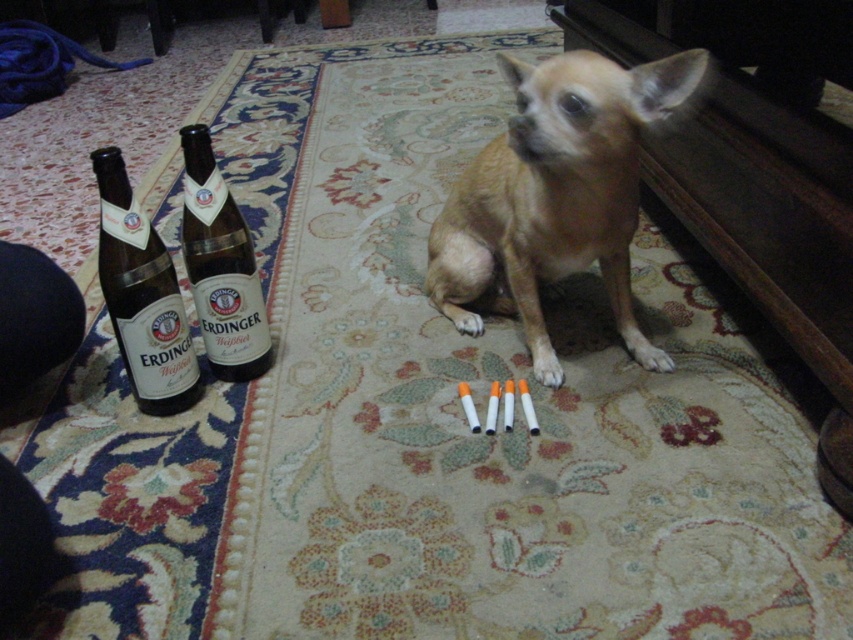
Question: Does brown glass beer bottle at left have a smaller size compared to brown glass bottle at left?

Choices:
 (A) no
 (B) yes

Answer: (B)

Question: Does light brown fur at center appear on the left side of brown glass bottle at left?

Choices:
 (A) yes
 (B) no

Answer: (B)

Question: Can you confirm if brown glass beer bottle at left is positioned below brown glass bottle at left?

Choices:
 (A) no
 (B) yes

Answer: (B)

Question: Which point appears farthest from the camera in this image?

Choices:
 (A) (225, 312)
 (B) (108, 209)
 (C) (582, 243)

Answer: (A)

Question: Based on their relative distances, which object is nearer to the light brown fur at center?

Choices:
 (A) brown glass beer bottle at left
 (B) brown glass bottle at left

Answer: (B)

Question: Which object is positioned farthest from the light brown fur at center?

Choices:
 (A) brown glass beer bottle at left
 (B) brown glass bottle at left

Answer: (A)